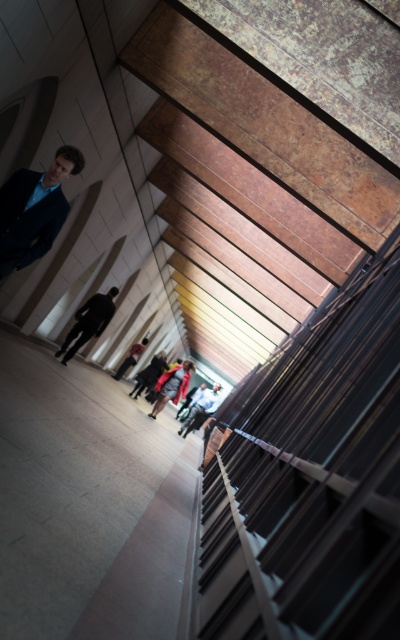
Which is more to the right, red velvet backpack at center or white fabric jacket at center?

Positioned to the right is white fabric jacket at center.

Between red velvet backpack at center and white fabric jacket at center, which one has more height?

With more height is red velvet backpack at center.

The width and height of the screenshot is (400, 640). I want to click on red velvet backpack at center, so click(x=172, y=387).

Locate an element on the screen. This screenshot has width=400, height=640. red velvet backpack at center is located at coordinates (172, 387).

Does dark gray suit at center appear under red fabric jacket at center?

Actually, dark gray suit at center is above red fabric jacket at center.

Is dark gray suit at center to the left of red fabric jacket at center from the viewer's perspective?

Yes, dark gray suit at center is to the left of red fabric jacket at center.

Locate an element on the screen. The image size is (400, 640). dark gray suit at center is located at coordinates (89, 323).

The height and width of the screenshot is (640, 400). What are the coordinates of `dark gray suit at center` in the screenshot? It's located at (89, 323).

Does white fabric jacket at center lie behind red fabric jacket at center?

Yes.

Who is higher up, white fabric jacket at center or red fabric jacket at center?

Positioned higher is red fabric jacket at center.

Image resolution: width=400 pixels, height=640 pixels. I want to click on white fabric jacket at center, so click(x=200, y=410).